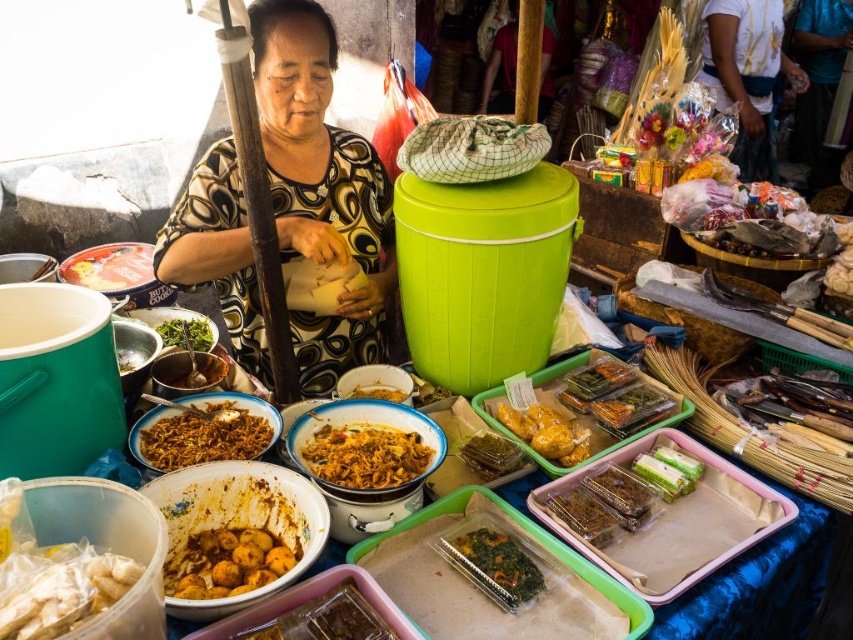
Question: Which point appears farthest from the camera in this image?

Choices:
 (A) (132, 289)
 (B) (514, 579)
 (C) (619, 492)
 (D) (494, 438)

Answer: (A)

Question: Does brown matte meatballs at center appear under pink glossy meat at upper left?

Choices:
 (A) yes
 (B) no

Answer: (A)

Question: Which point is closer to the camera taking this photo?

Choices:
 (A) (537, 444)
 (B) (117, 362)

Answer: (A)

Question: Which point is farther to the camera?

Choices:
 (A) (73, 592)
 (B) (503, 472)
 (C) (325, 60)

Answer: (C)

Question: Is translucent plastic containers at center to the left of yellowish matte shredded food at center from the viewer's perspective?

Choices:
 (A) no
 (B) yes

Answer: (A)

Question: Does brown matte food at lower center come behind matte white bowl at left?

Choices:
 (A) yes
 (B) no

Answer: (B)